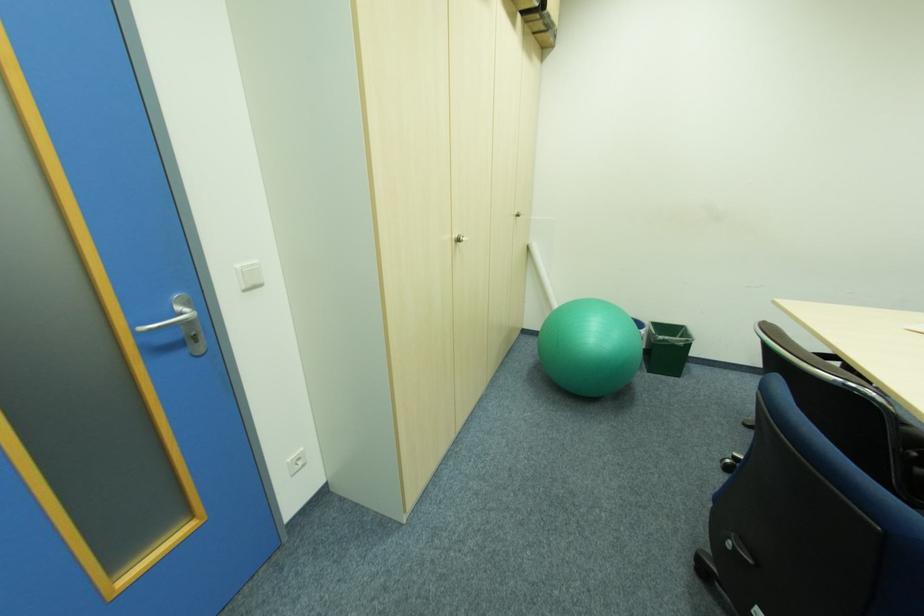
Identify the location of white electrical outlet. Image resolution: width=924 pixels, height=616 pixels. (296, 462).